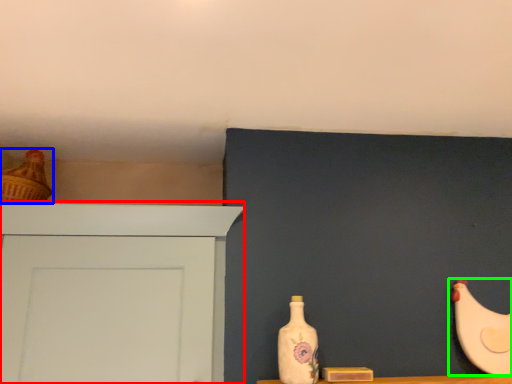
Question: Which object is positioned closest to door (highlighted by a red box)? Select from chicken (highlighted by a blue box) and chicken (highlighted by a green box).

Choices:
 (A) chicken
 (B) chicken

Answer: (A)